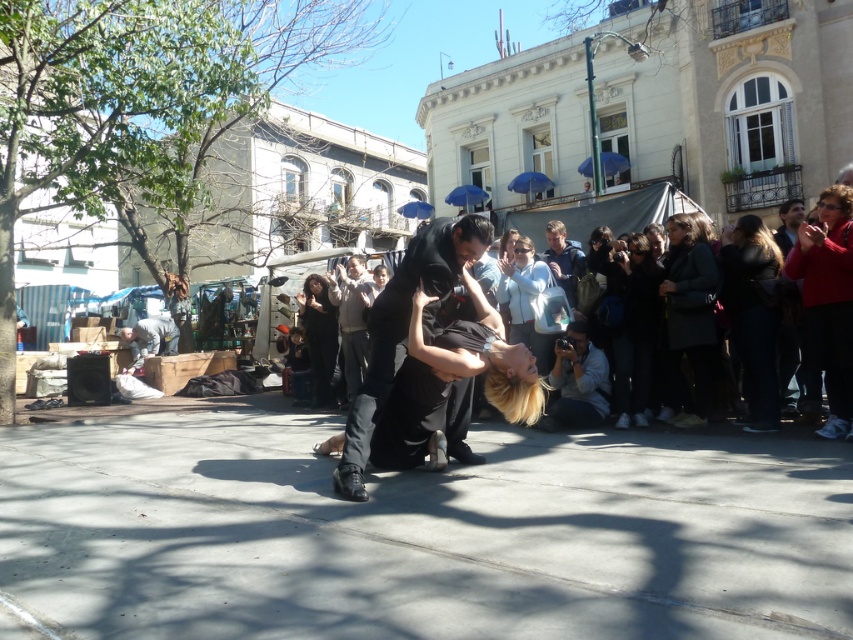
You are an observer standing in the street scene. You want to find the red sweater at right. Based on the coordinates provided, where should you look relative to the performers?

The red sweater at right is located at coordinates 0.470 on the x axis and 0.972 on the y axis, which means it is positioned to the right and slightly above the center of the image relative to the performers.

You are a photographer at the market and want to place both the dark gray coat at right and the gray fabric camera at lower right on a shelf. The shelf has a width of 1 meter. Can you fit both items side by side without overlapping?

The dark gray coat at right has a lesser width compared to gray fabric camera at lower right. If the total width of both items is less than 1 meter, they can fit. However, since the coat is narrower, you need to ensure their combined width does not exceed the shelf space.